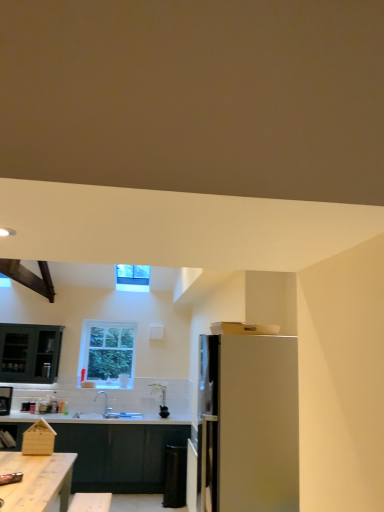
Question: From the image's perspective, is dark gray matte cabinetry at lower center above or below metallic silver toaster at lower left?

Choices:
 (A) above
 (B) below

Answer: (B)

Question: In the image, is dark gray matte cabinetry at lower center on the left side or the right side of metallic silver toaster at lower left?

Choices:
 (A) left
 (B) right

Answer: (B)

Question: Which of these objects is positioned closest to the white glass window at center?

Choices:
 (A) dark wood exhaust hood at upper left
 (B) dark gray matte cabinetry at lower center
 (C) white glossy sink at center
 (D) wooden table at lower left
 (E) white glossy refrigerator at right

Answer: (C)

Question: Which of these objects is positioned closest to the white glossy refrigerator at right?

Choices:
 (A) dark gray matte cabinetry at lower center
 (B) dark wood exhaust hood at upper left
 (C) white glass window at center
 (D) white glossy sink at center
 (E) metallic silver toaster at lower left

Answer: (B)